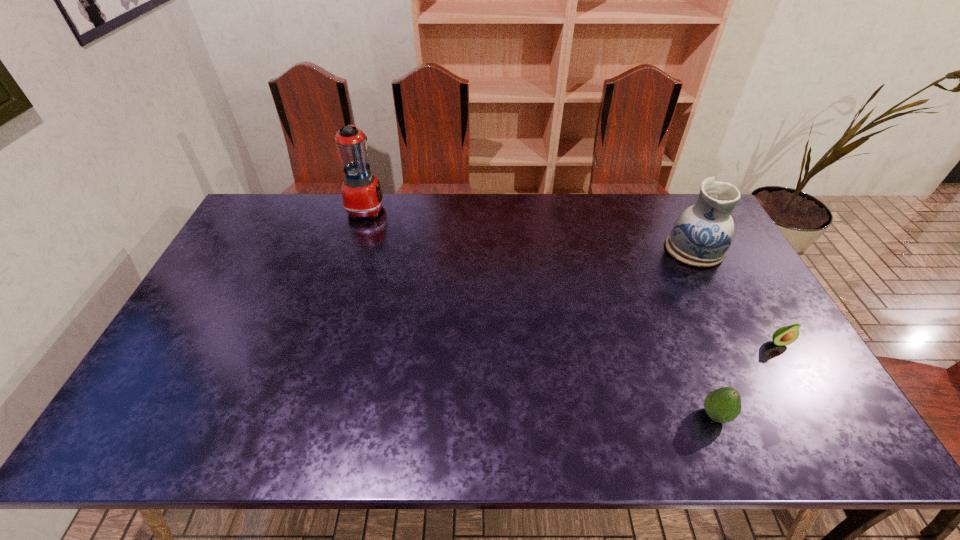
I want to click on vacant space at the right edge, so click(753, 355).

Image resolution: width=960 pixels, height=540 pixels. What are the coordinates of `vacant point at the far right corner` in the screenshot? It's located at (672, 215).

This screenshot has width=960, height=540. I want to click on free space at the near right corner of the desktop, so click(832, 427).

Identify the location of free spot between the farthest object and the shorter avocado. (572, 275).

Locate an element on the screen. blank region between the left avocado and the pottery is located at coordinates (705, 332).

Find the location of a particular element. Image resolution: width=960 pixels, height=540 pixels. free spot between the second nearest object and the food processor is located at coordinates (572, 275).

Identify the location of empty space between the right avocado and the second tallest object. The width and height of the screenshot is (960, 540). (736, 296).

Locate an element on the screen. The height and width of the screenshot is (540, 960). free spot between the shortest object and the third shortest object is located at coordinates (736, 296).

At what (x,y) coordinates should I click in order to perform the action: click on free space that is in between the leftmost object and the shorter avocado. Please return your answer as a coordinate pair (x, y). Image resolution: width=960 pixels, height=540 pixels. Looking at the image, I should click on (572, 275).

This screenshot has height=540, width=960. I want to click on empty space that is in between the second farthest object and the shorter avocado, so click(736, 296).